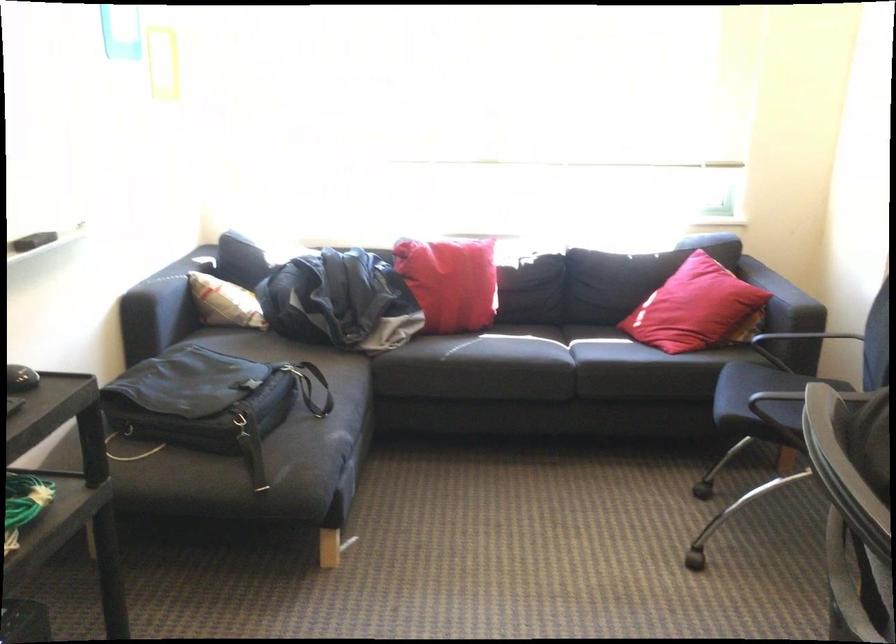
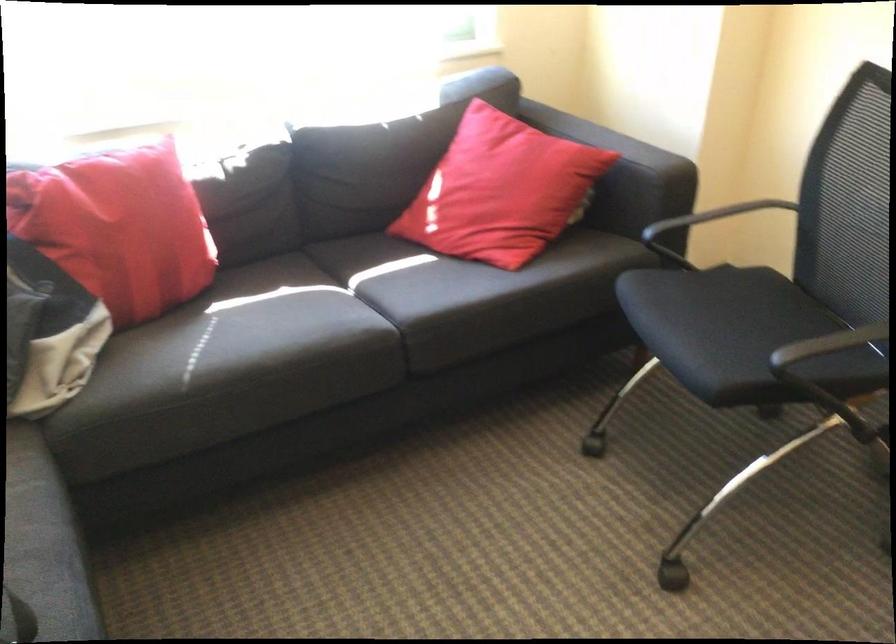
Locate, in the second image, the point that corresponds to pixel 688 301 in the first image.

(501, 190)